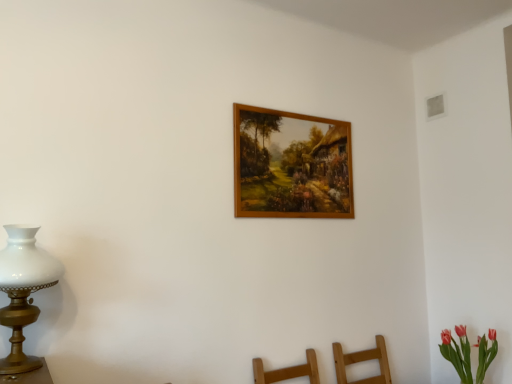
Question: Is white glass lamp at left positioned beyond the bounds of wooden picture frame at upper center?

Choices:
 (A) yes
 (B) no

Answer: (A)

Question: Is white glass lamp at left positioned with its back to wooden picture frame at upper center?

Choices:
 (A) no
 (B) yes

Answer: (A)

Question: Is white glass lamp at left to the left of wooden picture frame at upper center from the viewer's perspective?

Choices:
 (A) no
 (B) yes

Answer: (B)

Question: Could you tell me if white glass lamp at left is facing wooden picture frame at upper center?

Choices:
 (A) yes
 (B) no

Answer: (B)

Question: Considering the relative sizes of white glass lamp at left and wooden picture frame at upper center in the image provided, is white glass lamp at left bigger than wooden picture frame at upper center?

Choices:
 (A) yes
 (B) no

Answer: (A)

Question: Does point (272, 165) appear closer or farther from the camera than point (25, 292)?

Choices:
 (A) farther
 (B) closer

Answer: (A)

Question: From the image's perspective, is wooden picture frame at upper center positioned above or below white glass lamp at left?

Choices:
 (A) below
 (B) above

Answer: (B)

Question: In the image, is wooden picture frame at upper center positioned in front of or behind white glass lamp at left?

Choices:
 (A) front
 (B) behind

Answer: (B)

Question: Do you think wooden picture frame at upper center is within white glass lamp at left, or outside of it?

Choices:
 (A) outside
 (B) inside

Answer: (A)

Question: Which is correct: white glass lamp at left is inside vivid pink petals at lower right, or outside of it?

Choices:
 (A) outside
 (B) inside

Answer: (A)

Question: Looking at their shapes, would you say white glass lamp at left is wider or thinner than vivid pink petals at lower right?

Choices:
 (A) wide
 (B) thin

Answer: (B)

Question: Is white glass lamp at left bigger or smaller than vivid pink petals at lower right?

Choices:
 (A) big
 (B) small

Answer: (A)

Question: From the image's perspective, is white glass lamp at left above or below vivid pink petals at lower right?

Choices:
 (A) below
 (B) above

Answer: (B)

Question: Is white glass lamp at left situated inside wooden picture frame at upper center or outside?

Choices:
 (A) inside
 (B) outside

Answer: (B)

Question: Would you say white glass lamp at left is to the left or to the right of wooden picture frame at upper center in the picture?

Choices:
 (A) right
 (B) left

Answer: (B)